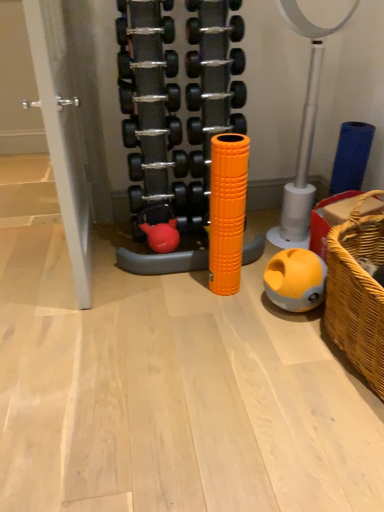
Locate an element on the screen. free space to the left of orange rubber foam roller at center, the third toy in the bottom-to-top sequence is located at coordinates (50, 262).